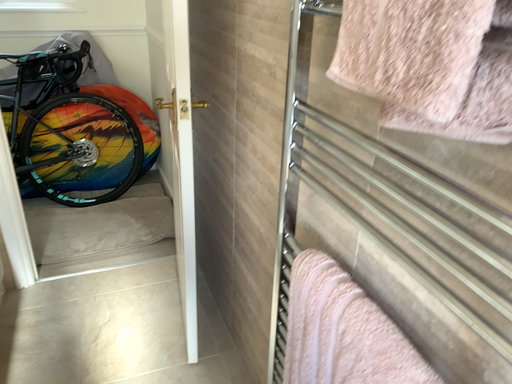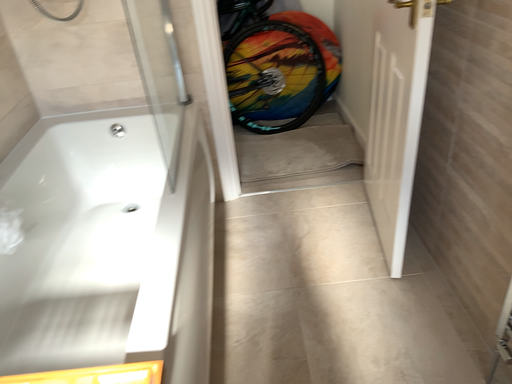
Question: Which way did the camera rotate in the video?

Choices:
 (A) rotated upward
 (B) rotated downward

Answer: (B)